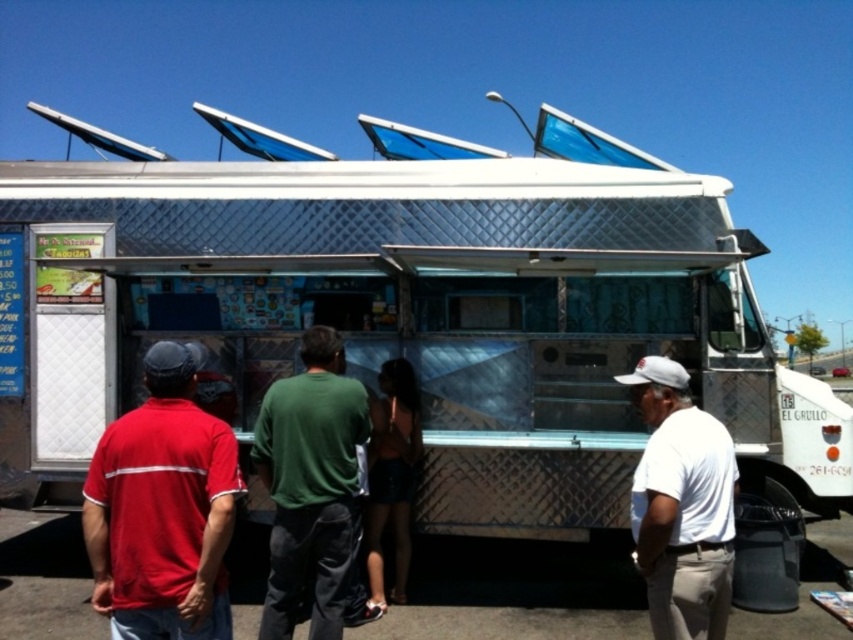
Looking at this image, is the position of matte red shirt at left less distant than that of green cotton shirt at center?

Yes, it is.

Is matte red shirt at left taller than green cotton shirt at center?

Incorrect, matte red shirt at left's height is not larger of green cotton shirt at center's.

Measure the distance between point (173, 429) and camera.

Point (173, 429) and camera are 2.90 meters apart.

Where is `matte red shirt at left`? This screenshot has width=853, height=640. matte red shirt at left is located at coordinates (161, 509).

Is matte red shirt at left further to the viewer compared to white matte shirt at right?

No, it is not.

Which is behind, point (109, 426) or point (660, 484)?

The point (109, 426) is behind.

Locate an element on the screen. The width and height of the screenshot is (853, 640). matte red shirt at left is located at coordinates (161, 509).

Is green cotton shirt at center behind white matte shirt at right?

Yes, green cotton shirt at center is behind white matte shirt at right.

Is green cotton shirt at center thinner than white matte shirt at right?

Incorrect, green cotton shirt at center's width is not less than white matte shirt at right's.

Does point (328, 387) lie behind point (659, 520)?

Yes, point (328, 387) is farther from viewer.

This screenshot has width=853, height=640. I want to click on green cotton shirt at center, so click(x=311, y=483).